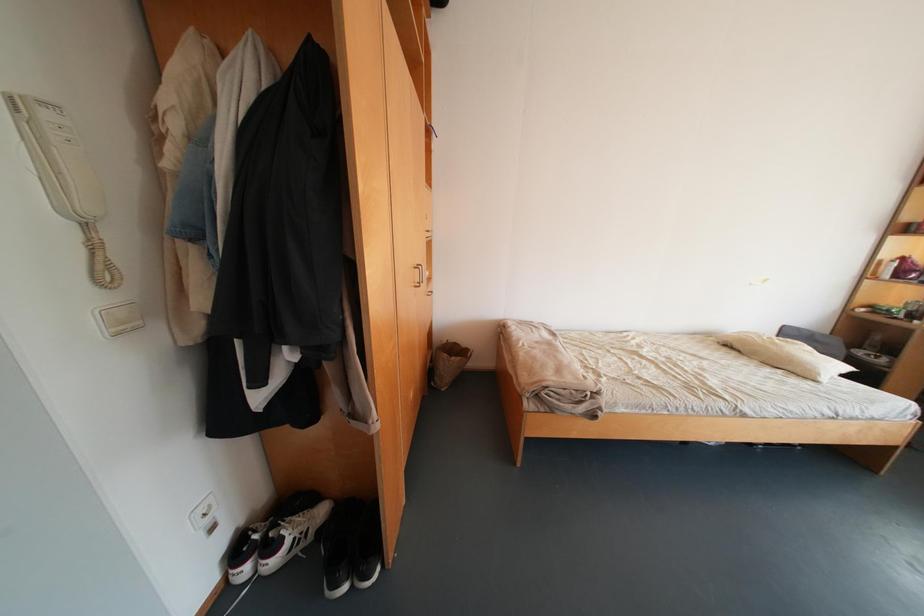
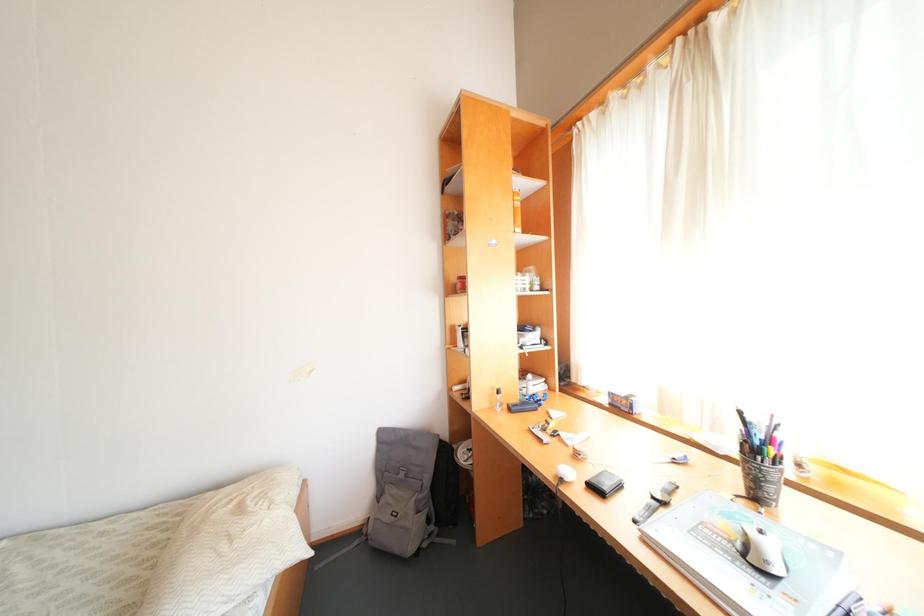
Question: Which direction would the cameraman need to move to produce the second image? Reply with the corresponding letter.

Choices:
 (A) Left
 (B) Right
 (C) Forward
 (D) Backward

Answer: (B)